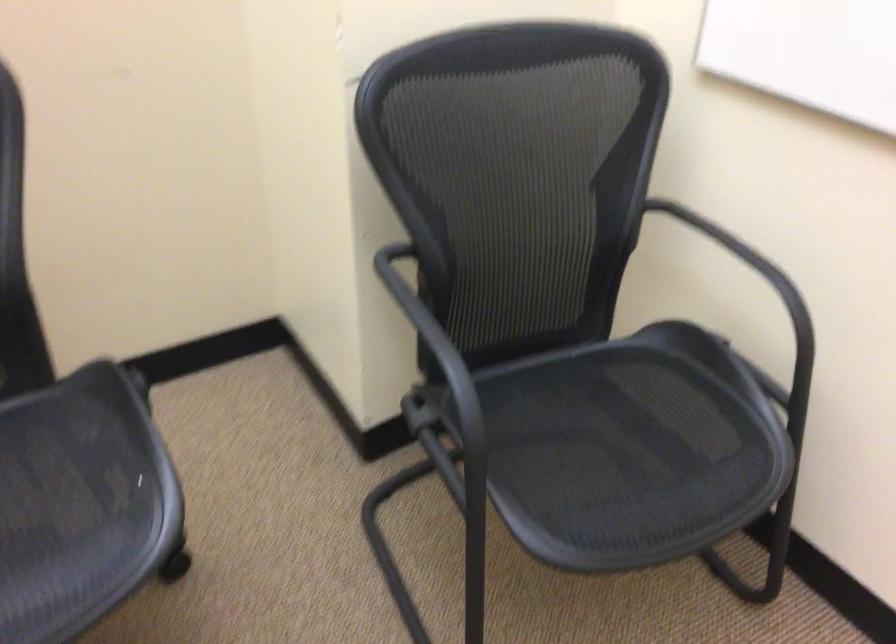
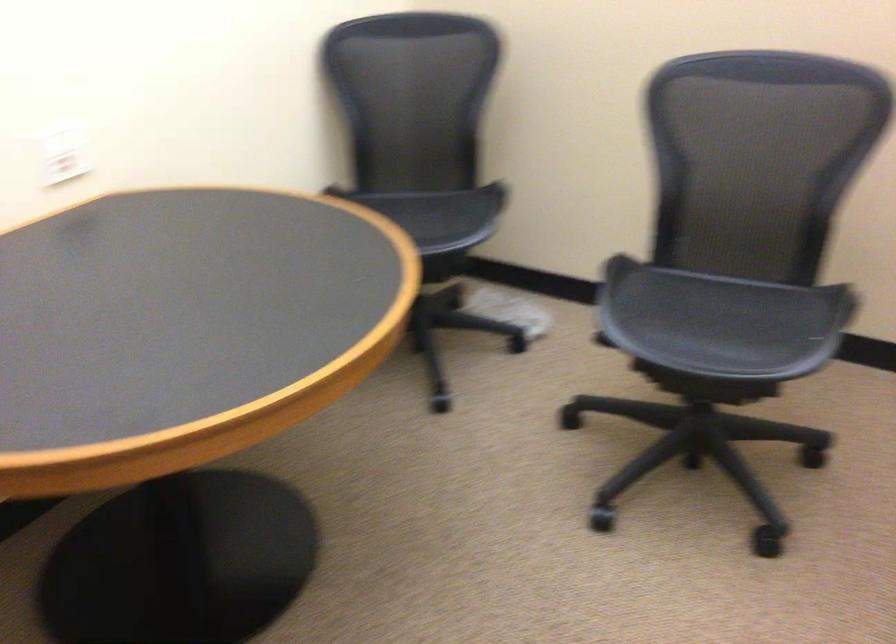
Question: The first image is from the beginning of the video and the second image is from the end. How did the camera likely rotate when shooting the video?

Choices:
 (A) Left
 (B) Right
 (C) Up
 (D) Down

Answer: (A)